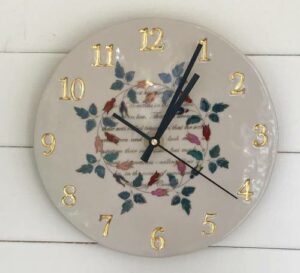
What are the coordinates of `clock face` in the screenshot? It's located at (231, 135).